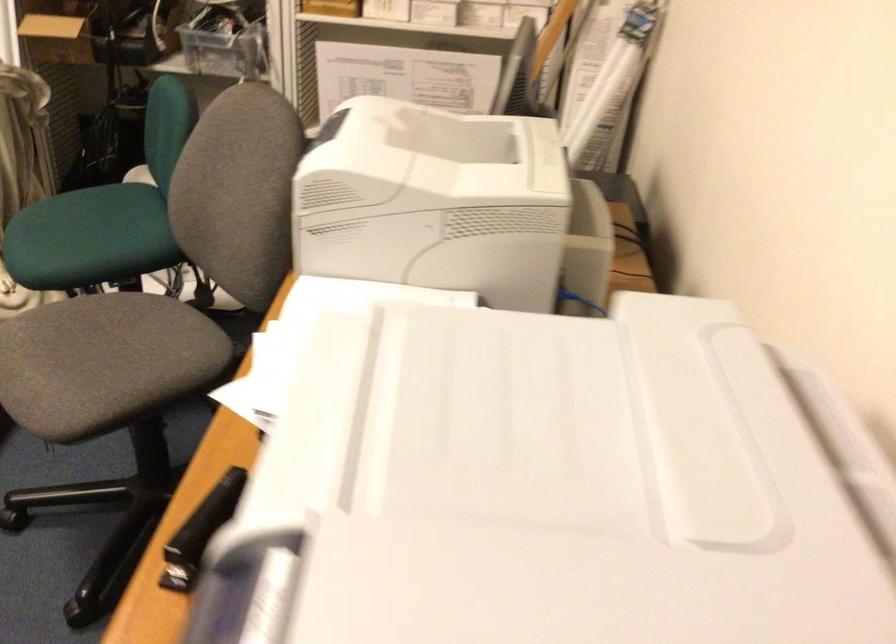
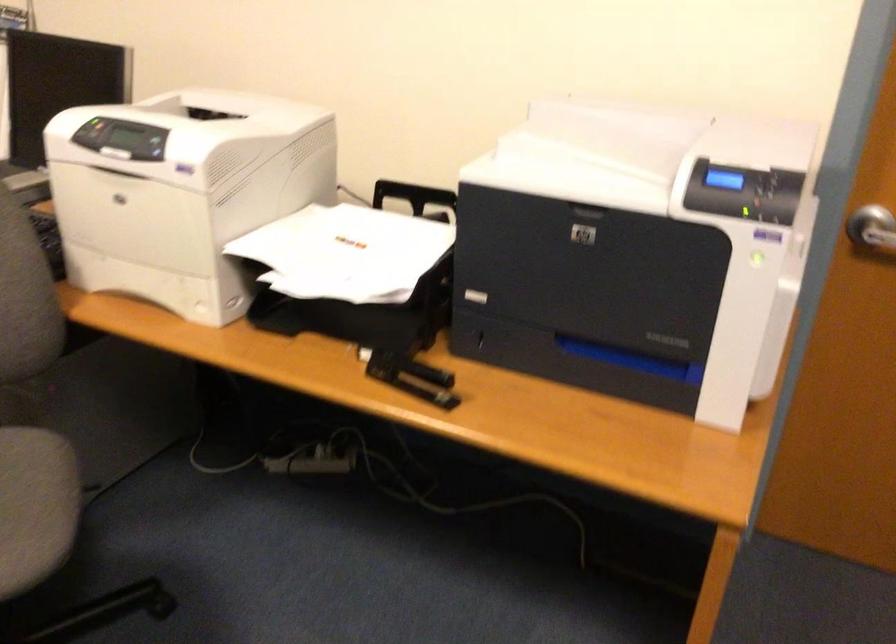
Locate, in the second image, the point that corresponds to [315,147] in the first image.

(151, 144)